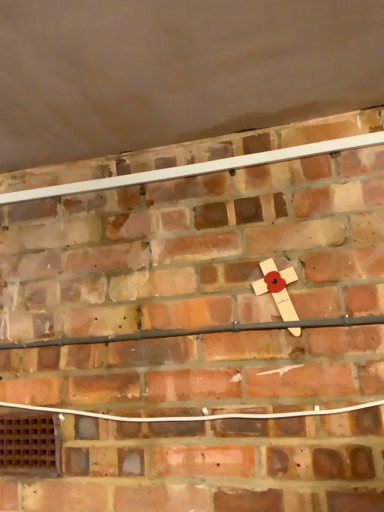
Question: Does brown wooden vent at lower left appear on the right side of wooden cross at center?

Choices:
 (A) yes
 (B) no

Answer: (B)

Question: Considering the relative sizes of brown wooden vent at lower left and wooden cross at center in the image provided, is brown wooden vent at lower left wider than wooden cross at center?

Choices:
 (A) yes
 (B) no

Answer: (B)

Question: Is brown wooden vent at lower left shorter than wooden cross at center?

Choices:
 (A) yes
 (B) no

Answer: (A)

Question: Can you confirm if brown wooden vent at lower left is bigger than wooden cross at center?

Choices:
 (A) yes
 (B) no

Answer: (B)

Question: Are brown wooden vent at lower left and wooden cross at center beside each other?

Choices:
 (A) yes
 (B) no

Answer: (B)

Question: From a real-world perspective, is brown wooden vent at lower left over wooden cross at center?

Choices:
 (A) no
 (B) yes

Answer: (A)

Question: Is wooden cross at center surrounding brown wooden vent at lower left?

Choices:
 (A) no
 (B) yes

Answer: (A)

Question: Can you confirm if wooden cross at center is taller than brown wooden vent at lower left?

Choices:
 (A) no
 (B) yes

Answer: (B)

Question: Does wooden cross at center have a lesser width compared to brown wooden vent at lower left?

Choices:
 (A) yes
 (B) no

Answer: (B)

Question: From a real-world perspective, is wooden cross at center over brown wooden vent at lower left?

Choices:
 (A) yes
 (B) no

Answer: (A)

Question: Can you confirm if wooden cross at center is shorter than brown wooden vent at lower left?

Choices:
 (A) no
 (B) yes

Answer: (A)

Question: Is wooden cross at center further to camera compared to brown wooden vent at lower left?

Choices:
 (A) no
 (B) yes

Answer: (A)

Question: Is wooden cross at center situated inside brown wooden vent at lower left or outside?

Choices:
 (A) outside
 (B) inside

Answer: (A)